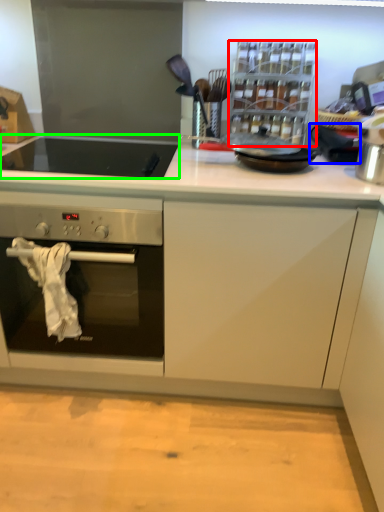
Question: Which object is positioned closest to appliance (highlighted by a red box)? Select from appliance (highlighted by a blue box) and gas stove (highlighted by a green box).

Choices:
 (A) appliance
 (B) gas stove

Answer: (A)